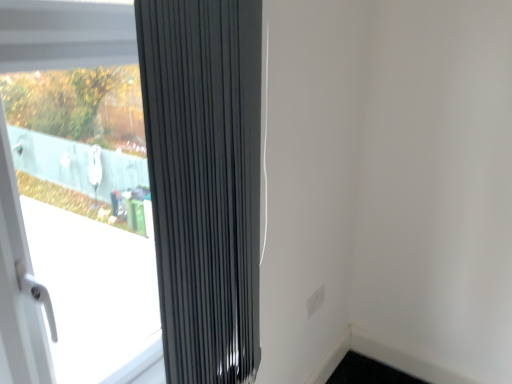
The height and width of the screenshot is (384, 512). What do you see at coordinates (204, 181) in the screenshot? I see `black glossy curtain at center` at bounding box center [204, 181].

Locate an element on the screen. black glossy curtain at center is located at coordinates (204, 181).

Image resolution: width=512 pixels, height=384 pixels. What are the coordinates of `black glossy curtain at center` in the screenshot? It's located at (204, 181).